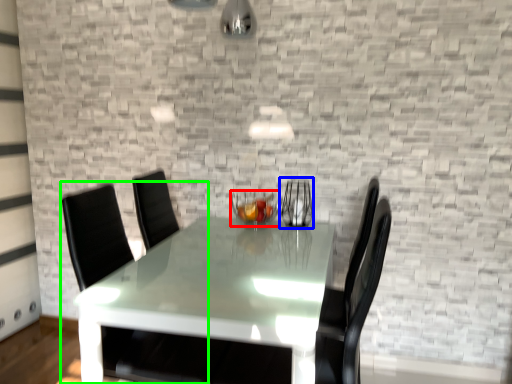
Question: Estimate the real-world distances between objects in this image. Which object is closer to candle holder (highlighted by a red box), glass vase (highlighted by a blue box) or swivel chair (highlighted by a green box)?

Choices:
 (A) glass vase
 (B) swivel chair

Answer: (A)